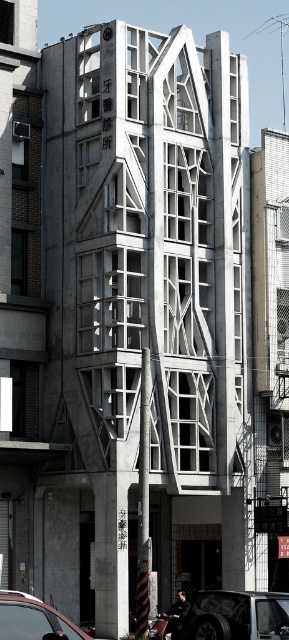
Question: Considering the relative positions of black matte car at center and metallic silver car at lower left in the image provided, where is black matte car at center located with respect to metallic silver car at lower left?

Choices:
 (A) above
 (B) below

Answer: (B)

Question: Which of the following is the closest to the observer?

Choices:
 (A) black matte car at center
 (B) metallic silver car at lower left

Answer: (B)

Question: Can you confirm if black matte car at center is wider than metallic silver car at lower left?

Choices:
 (A) yes
 (B) no

Answer: (A)

Question: Does black matte car at center lie behind metallic silver car at lower left?

Choices:
 (A) yes
 (B) no

Answer: (A)

Question: Which point is farther from the camera taking this photo?

Choices:
 (A) (210, 616)
 (B) (34, 620)

Answer: (A)